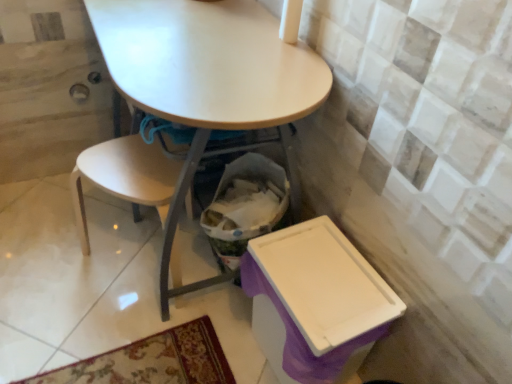
Measure the distance between purple plastic box at lower right and camera.

They are 36.85 inches apart.

You are a GUI agent. You are given a task and a screenshot of the screen. Output one action in this format:
    pyautogui.click(x=<x>, y=<y>)
    Task: Click on the purple plastic box at lower right
    
    Given the screenshot: What is the action you would take?
    pyautogui.click(x=315, y=302)

Where is `light wood chair at lower left`? This screenshot has width=512, height=384. light wood chair at lower left is located at coordinates (125, 177).

Can you confirm if purple plastic box at lower right is taller than matte white table at center?

Incorrect, the height of purple plastic box at lower right is not larger of that of matte white table at center.

Considering the sizes of purple plastic box at lower right and matte white table at center in the image, is purple plastic box at lower right bigger or smaller than matte white table at center?

Clearly, purple plastic box at lower right is smaller in size than matte white table at center.

Relative to purple plastic box at lower right, is matte white table at center in front or behind?

Visually, matte white table at center is located in front of purple plastic box at lower right.

From a real-world perspective, is matte white table at center beneath purple plastic box at lower right?

No.

From the picture: Is matte white table at center oriented away from purple plastic box at lower right?

No.

Is matte white table at center not within purple plastic box at lower right?

Yes.

Can you confirm if light wood chair at lower left is wider than matte white table at center?

No, light wood chair at lower left is not wider than matte white table at center.

From a real-world perspective, between light wood chair at lower left and matte white table at center, who is vertically lower?

light wood chair at lower left.

In the scene shown: From the image's perspective, between light wood chair at lower left and matte white table at center, which one is located above?

matte white table at center.

Which of these two, light wood chair at lower left or matte white table at center, stands shorter?

light wood chair at lower left.

Is light wood chair at lower left next to purple plastic box at lower right?

There is a gap between light wood chair at lower left and purple plastic box at lower right.

The width and height of the screenshot is (512, 384). What are the coordinates of `box in front of the light wood chair at lower left` in the screenshot? It's located at (315, 302).

Considering the relative sizes of light wood chair at lower left and purple plastic box at lower right in the image provided, is light wood chair at lower left taller than purple plastic box at lower right?

Indeed, light wood chair at lower left has a greater height compared to purple plastic box at lower right.

Would you say purple plastic box at lower right is outside light wood chair at lower left?

Yes, purple plastic box at lower right is not within light wood chair at lower left.

Can you confirm if purple plastic box at lower right is thinner than light wood chair at lower left?

Yes, purple plastic box at lower right is thinner than light wood chair at lower left.

What's the angular difference between purple plastic box at lower right and light wood chair at lower left's facing directions?

purple plastic box at lower right and light wood chair at lower left are facing 15.9 degrees away from each other.

Is purple plastic box at lower right in front of or behind light wood chair at lower left in the image?

In the image, purple plastic box at lower right appears in front of light wood chair at lower left.

Between matte white table at center and light wood chair at lower left, which one has smaller width?

light wood chair at lower left.

Does matte white table at center have a lesser height compared to light wood chair at lower left?

No.

Is matte white table at center positioned in front of light wood chair at lower left?

Yes, it is in front of light wood chair at lower left.

This screenshot has width=512, height=384. I want to click on chair below the matte white table at center (from a real-world perspective), so click(125, 177).

At what (x,y) coordinates should I click in order to perform the action: click on box lying on the right of matte white table at center. Please return your answer as a coordinate pair (x, y). This screenshot has width=512, height=384. Looking at the image, I should click on (315, 302).

Locate an element on the screen. This screenshot has width=512, height=384. box below the matte white table at center (from the image's perspective) is located at coordinates pyautogui.click(x=315, y=302).

Considering their positions, is purple plastic box at lower right positioned further to matte white table at center than light wood chair at lower left?

purple plastic box at lower right lies further to matte white table at center than the other object.

From the image, which object appears to be farther from light wood chair at lower left, purple plastic box at lower right or matte white table at center?

Among the two, purple plastic box at lower right is located further to light wood chair at lower left.

Estimate the real-world distances between objects in this image. Which object is closer to light wood chair at lower left, matte white table at center or purple plastic box at lower right?

matte white table at center is positioned closer to the anchor light wood chair at lower left.

Considering their positions, is matte white table at center positioned closer to purple plastic box at lower right than light wood chair at lower left?

matte white table at center is positioned closer to the anchor purple plastic box at lower right.

Looking at the image, which one is located further to matte white table at center, light wood chair at lower left or purple plastic box at lower right?

Among the two, purple plastic box at lower right is located further to matte white table at center.

From the image, which object appears to be nearer to purple plastic box at lower right, light wood chair at lower left or matte white table at center?

matte white table at center.

At what (x,y) coordinates should I click in order to perform the action: click on table situated between light wood chair at lower left and purple plastic box at lower right from left to right. Please return your answer as a coordinate pair (x, y). This screenshot has width=512, height=384. Looking at the image, I should click on (207, 78).